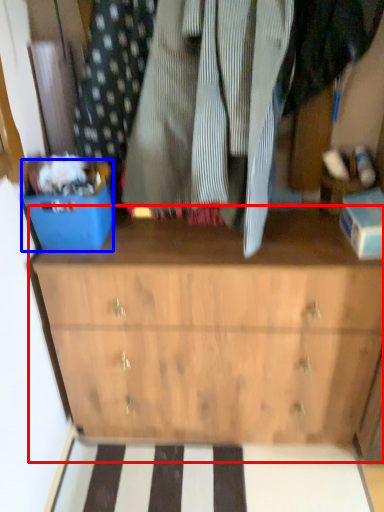
Question: Which of the following is the closest to the observer, chest of drawers (highlighted by a red box) or storage box (highlighted by a blue box)?

Choices:
 (A) chest of drawers
 (B) storage box

Answer: (B)